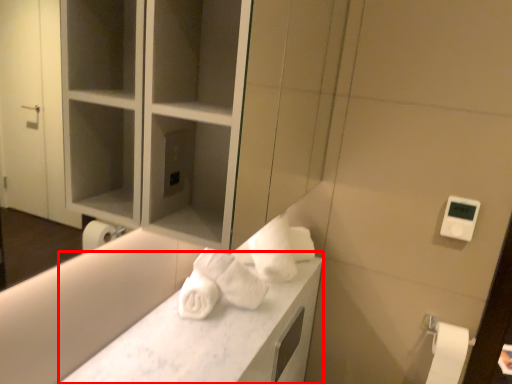
Question: Considering the relative positions of counter top (annotated by the red box) and toilet paper in the image provided, where is counter top (annotated by the red box) located with respect to the staircase?

Choices:
 (A) right
 (B) left

Answer: (B)